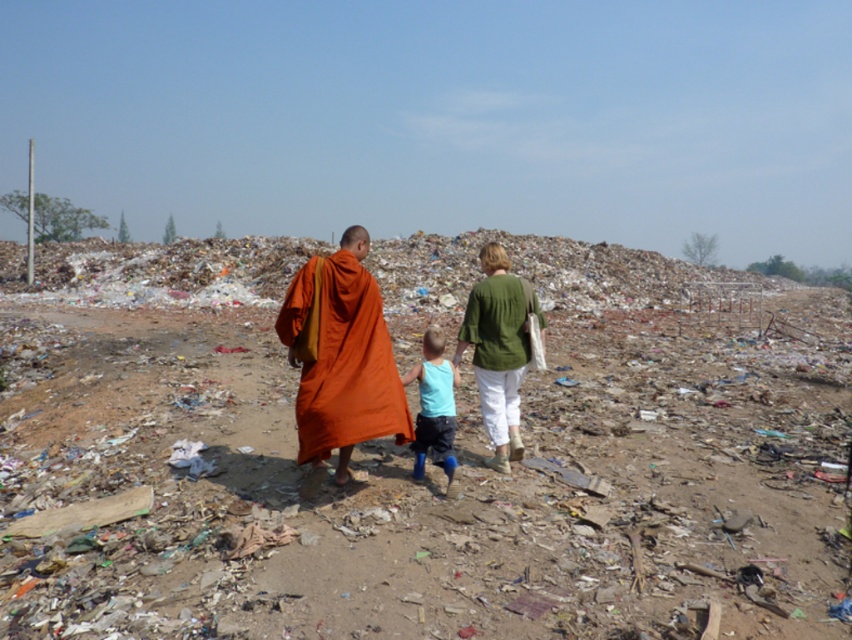
Between orange cloth monk at center and orange cloth robe at center, which one appears on the left side from the viewer's perspective?

orange cloth monk at center

Is point (573, 612) closer to camera compared to point (338, 326)?

Yes, it is in front of point (338, 326).

Between point (545, 374) and point (330, 305), which one is positioned behind?

Point (545, 374)

Identify the location of orange cloth monk at center. (410, 470).

This screenshot has height=640, width=852. Describe the element at coordinates (349, 368) in the screenshot. I see `orange cloth robe at center` at that location.

Who is higher up, orange cloth robe at center or light blue fabric at center?

orange cloth robe at center

Is point (321, 304) farther from camera compared to point (424, 440)?

No, it is in front of (424, 440).

In order to click on orange cloth robe at center in this screenshot , I will do `click(349, 368)`.

Between point (330, 276) and point (524, 349), which one is positioned in front?

Point (330, 276) is more forward.

Which is more to the right, orange cloth robe at center or light blue fabric shirt at center?

light blue fabric shirt at center

At what (x,y) coordinates should I click in order to perform the action: click on orange cloth robe at center. Please return your answer as a coordinate pair (x, y). Looking at the image, I should click on (349, 368).

Locate an element on the screen. orange cloth robe at center is located at coordinates (349, 368).